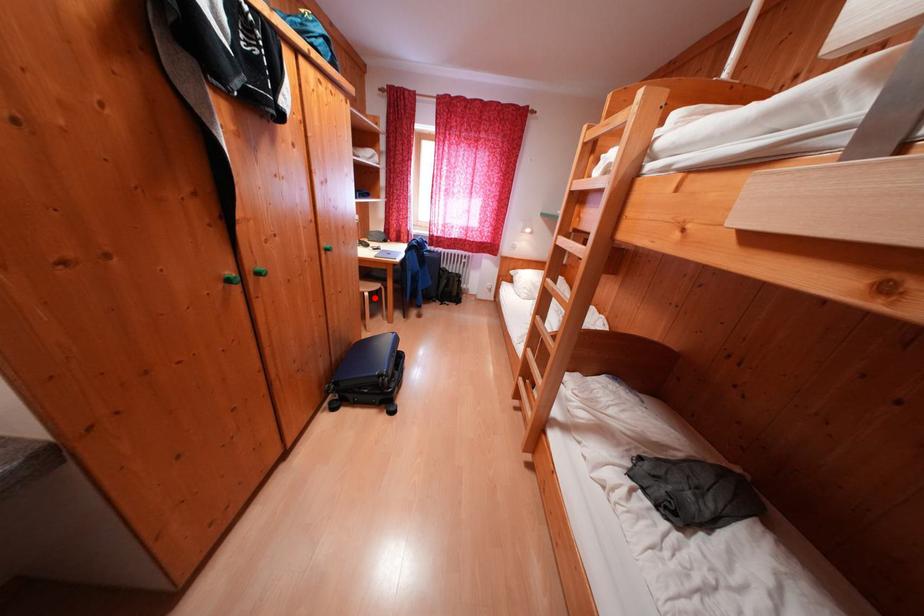
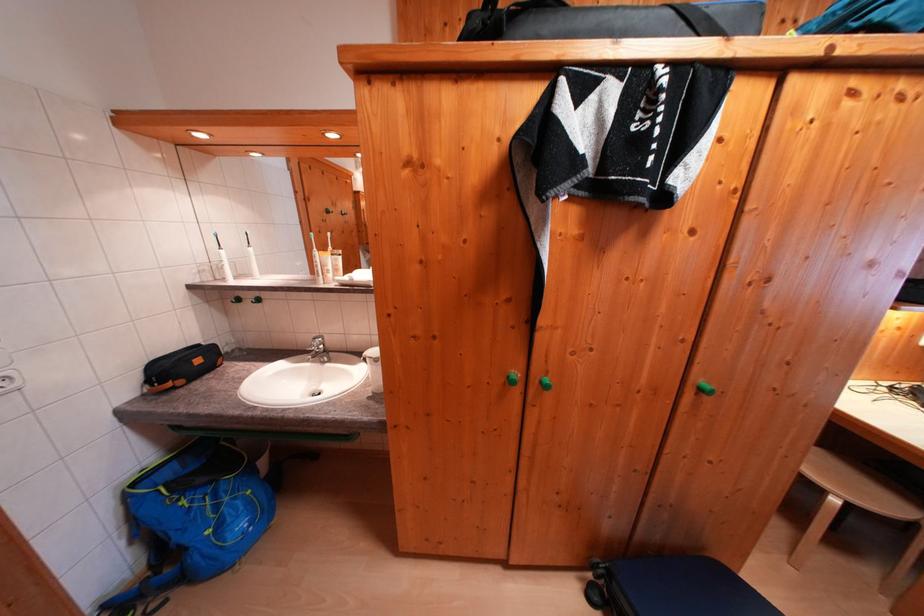
Find the pixel in the second image that matches the highlighted location in the first image.

(843, 505)